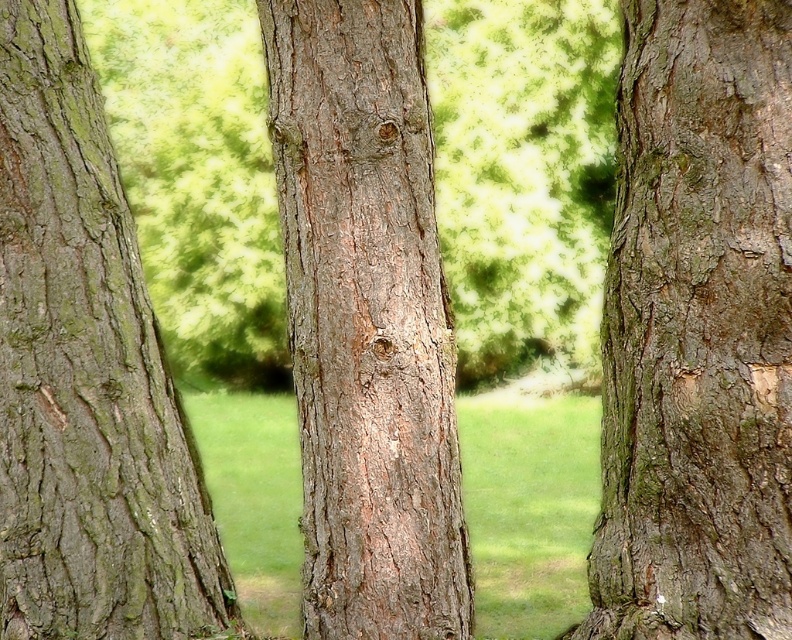
Question: In this image, where is green rough bark tree at right located relative to smooth brown bark at center?

Choices:
 (A) above
 (B) below

Answer: (B)

Question: Does green rough bark tree at right appear on the right side of green rough bark at center?

Choices:
 (A) yes
 (B) no

Answer: (A)

Question: Which of the following is the farthest from the observer?

Choices:
 (A) green rough bark tree at right
 (B) green rough bark at center

Answer: (B)

Question: Which of these objects is positioned closest to the smooth brown bark at center?

Choices:
 (A) green rough bark tree at right
 (B) green rough bark at center

Answer: (A)

Question: Which object is positioned closest to the green rough bark tree at right?

Choices:
 (A) green rough bark at center
 (B) smooth brown bark at center

Answer: (B)

Question: Is green rough bark tree at right thinner than smooth brown bark at center?

Choices:
 (A) yes
 (B) no

Answer: (A)